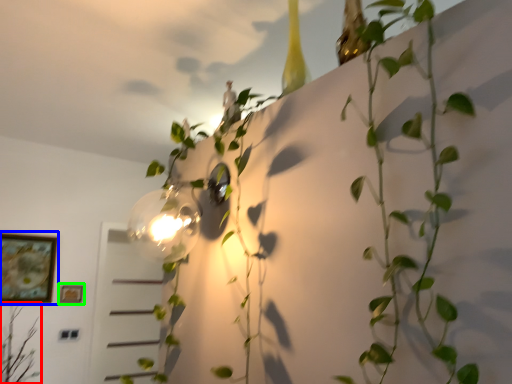
Question: Considering the real-world distances, which object is closest to plant (highlighted by a red box)? picture frame (highlighted by a blue box) or picture frame (highlighted by a green box).

Choices:
 (A) picture frame
 (B) picture frame

Answer: (A)